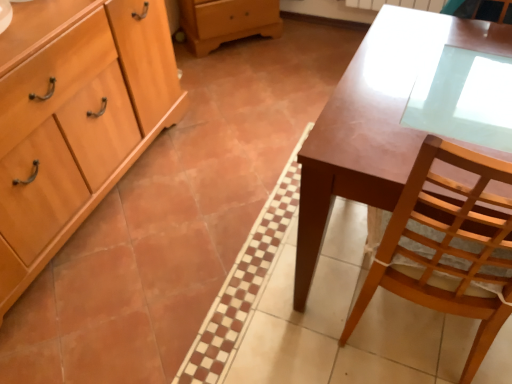
Question: From the image's perspective, is matte brown desk at center over light wood cabinet at left?

Choices:
 (A) no
 (B) yes

Answer: (A)

Question: Does matte brown desk at center have a greater width compared to light wood cabinet at left?

Choices:
 (A) no
 (B) yes

Answer: (B)

Question: From the image's perspective, is matte brown desk at center below light wood cabinet at left?

Choices:
 (A) yes
 (B) no

Answer: (A)

Question: Is matte brown desk at center taller than light wood cabinet at left?

Choices:
 (A) yes
 (B) no

Answer: (B)

Question: From a real-world perspective, is matte brown desk at center positioned under light wood cabinet at left based on gravity?

Choices:
 (A) yes
 (B) no

Answer: (A)

Question: Can you confirm if matte brown desk at center is positioned to the left of light wood cabinet at left?

Choices:
 (A) no
 (B) yes

Answer: (A)

Question: Does light wood cabinet at left have a larger size compared to matte brown desk at center?

Choices:
 (A) no
 (B) yes

Answer: (B)

Question: Can you confirm if light wood cabinet at left is smaller than matte brown desk at center?

Choices:
 (A) yes
 (B) no

Answer: (B)

Question: Is light wood cabinet at left located outside matte brown desk at center?

Choices:
 (A) no
 (B) yes

Answer: (B)

Question: Is light wood cabinet at left thinner than matte brown desk at center?

Choices:
 (A) yes
 (B) no

Answer: (A)

Question: From a real-world perspective, is light wood cabinet at left located higher than matte brown desk at center?

Choices:
 (A) yes
 (B) no

Answer: (A)

Question: Is light wood cabinet at left aimed at matte brown desk at center?

Choices:
 (A) no
 (B) yes

Answer: (B)

Question: From a real-world perspective, is matte brown desk at center physically located above or below light wood cabinet at left?

Choices:
 (A) below
 (B) above

Answer: (A)